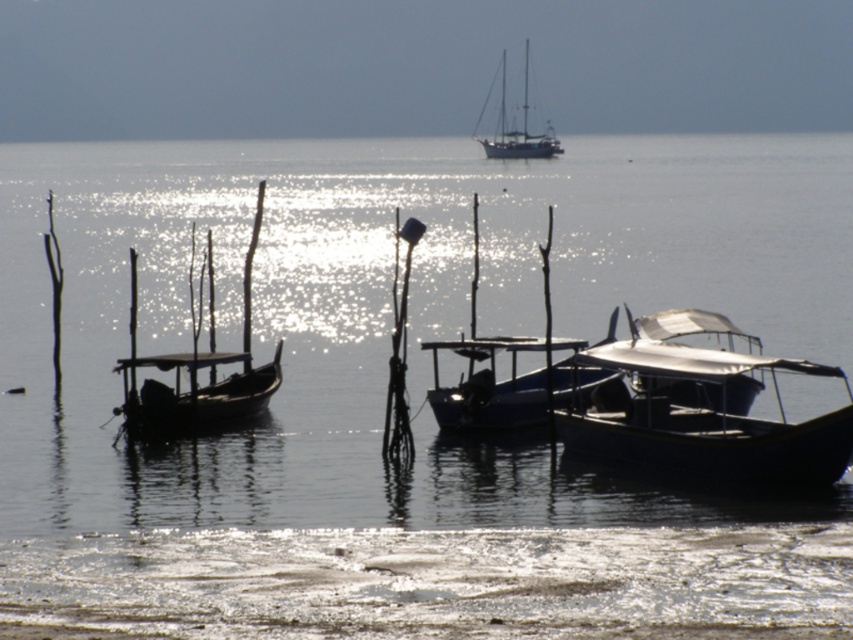
Question: Which object is closer to the camera taking this photo?

Choices:
 (A) dark wood boat at left
 (B) blue matte boat at center

Answer: (B)

Question: In this image, where is metallic blue boat at lower right located relative to blue matte boat at center?

Choices:
 (A) right
 (B) left

Answer: (A)

Question: Which of the following is the closest to the observer?

Choices:
 (A) (270, 380)
 (B) (503, 51)

Answer: (A)

Question: Is metallic blue boat at lower right further to the viewer compared to blue matte boat at center?

Choices:
 (A) yes
 (B) no

Answer: (B)

Question: Which is nearer to the dark wood boat at left?

Choices:
 (A) blue matte boat at center
 (B) blue glossy sailboat at upper center
 (C) metallic blue boat at lower right

Answer: (A)

Question: In this image, where is metallic blue boat at lower right located relative to blue glossy sailboat at upper center?

Choices:
 (A) right
 (B) left

Answer: (B)